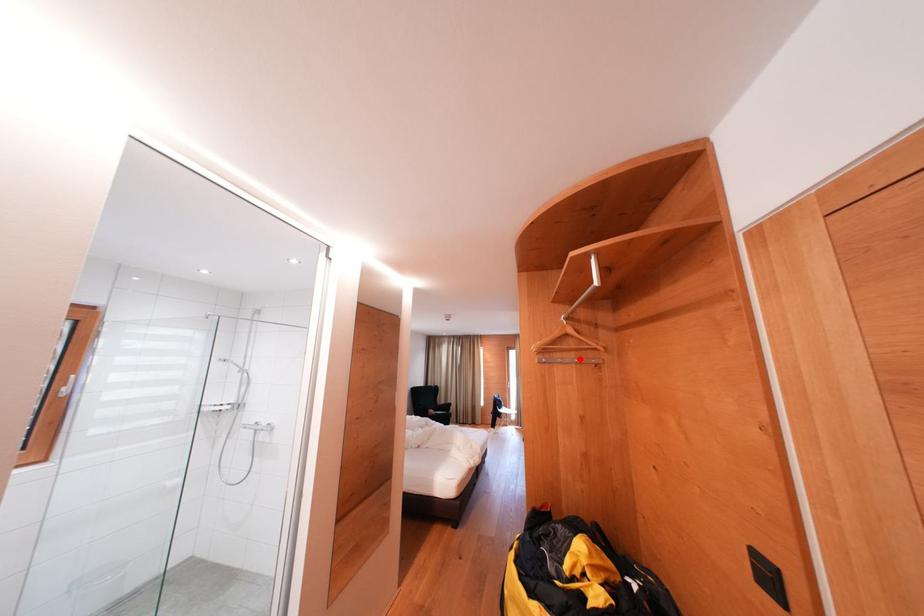
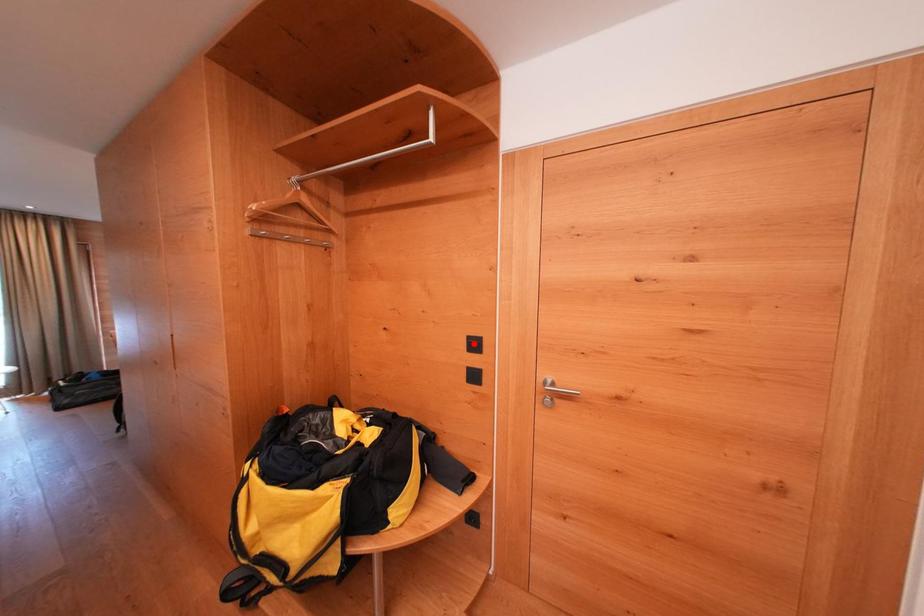
I am providing you with two images of the same scene from different viewpoints. A red point is marked on the first image and another point is marked on the second image. Are the points marked in image1 and image2 representing the same 3D position?

No